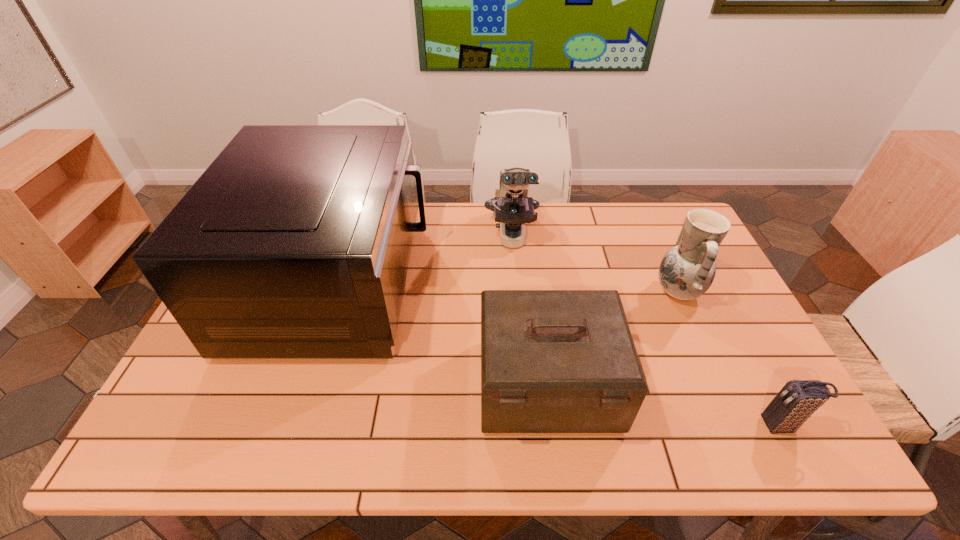
What are the coordinates of `free location located 0.190m on the back of the first-aid kit` in the screenshot? It's located at (536, 288).

Image resolution: width=960 pixels, height=540 pixels. What are the coordinates of `vacant space situated 0.140m with the zip open on the shortest object` in the screenshot? It's located at (697, 426).

At what (x,y) coordinates should I click in order to perform the action: click on vacant area located with the zip open on the shortest object. Please return your answer as a coordinate pair (x, y). Looking at the image, I should click on (723, 426).

Identify the location of blank area located with the zip open on the shortest object. (692, 426).

Identify the location of microwave_oven situated at the far edge. The width and height of the screenshot is (960, 540). (295, 243).

Locate an element on the screen. The height and width of the screenshot is (540, 960). microscope positioned at the far edge is located at coordinates (512, 208).

This screenshot has width=960, height=540. Identify the location of the first-aid kit present at the near edge. (552, 361).

At what (x,y) coordinates should I click in order to perform the action: click on clutch bag present at the near edge. Please return your answer as a coordinate pair (x, y). Looking at the image, I should click on (798, 399).

Find the location of a particular element. object located in the left edge section of the desktop is located at coordinates (295, 243).

Locate an element on the screen. This screenshot has width=960, height=540. pottery at the right edge is located at coordinates (686, 272).